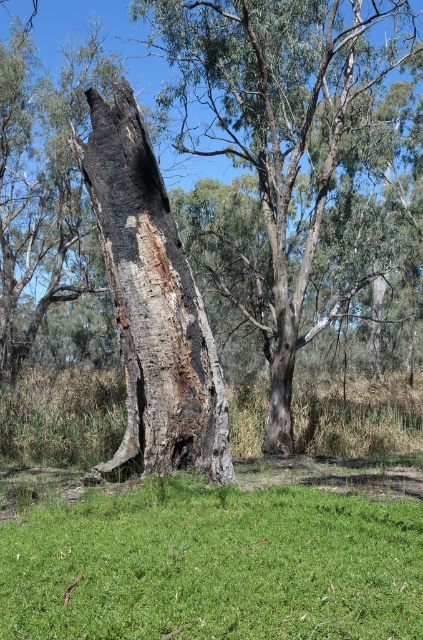
You are a gardener trying to plant a new flower bed. You notice the green grass at center and the charcoal rough bark tree trunk at center in the scene. Which object would be more suitable for placing the flower bed, and why?

The green grass at center is more suitable for placing the flower bed because it has a smaller size compared to the charcoal rough bark tree trunk at center, making it a better location for planting.

You are standing at the center of the image. Which direction should you move to reach the charcoal bark tree at left?

Since the charcoal bark tree at left is located at point (279, 124), which is to the left side of the image, you should move to the left to reach it.

You are standing at a point in the scene and want to know how far you are from the point marked as point (167,512). Can you determine the distance?

The distance between you and point (167,512) is 6.20 meters.